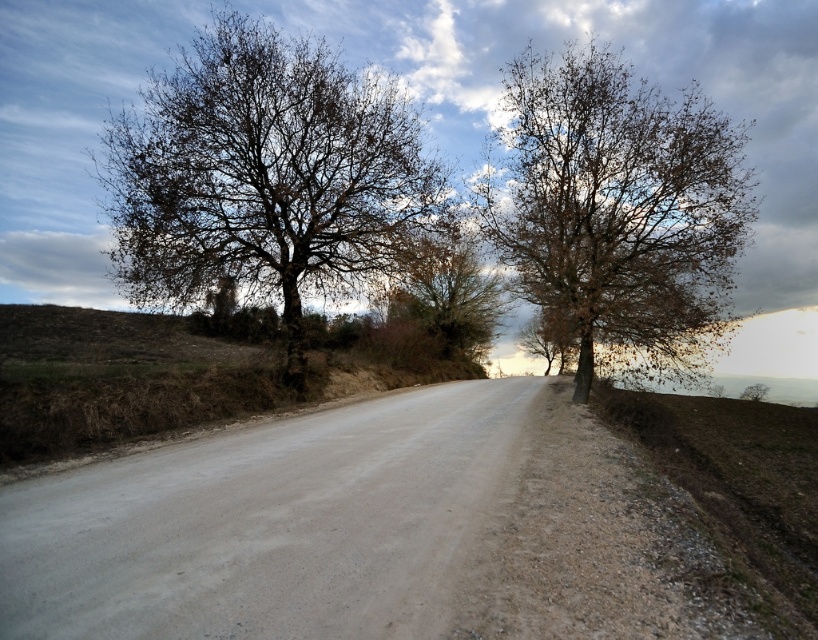
Is point (115, 193) less distant than point (144, 369)?

No, (115, 193) is further to viewer.

Is the position of brown leafy tree at left more distant than that of brown grassy hill at lower left?

That is True.

Between point (276, 38) and point (151, 388), which one is positioned behind?

The point (276, 38) is behind.

The width and height of the screenshot is (818, 640). I want to click on brown leafy tree at left, so click(263, 176).

How much distance is there between gray gravel road at center and brown leafy tree at right?

gray gravel road at center is 9.12 meters from brown leafy tree at right.

Locate an element on the screen. The image size is (818, 640). gray gravel road at center is located at coordinates (358, 531).

Identify the location of gray gravel road at center. The height and width of the screenshot is (640, 818). (358, 531).

Is brown leafy tree at right in front of brown leafy tree at center?

Yes, it is.

Which is below, brown leafy tree at right or brown leafy tree at center?

brown leafy tree at center

Locate an element on the screen. brown leafy tree at right is located at coordinates (618, 205).